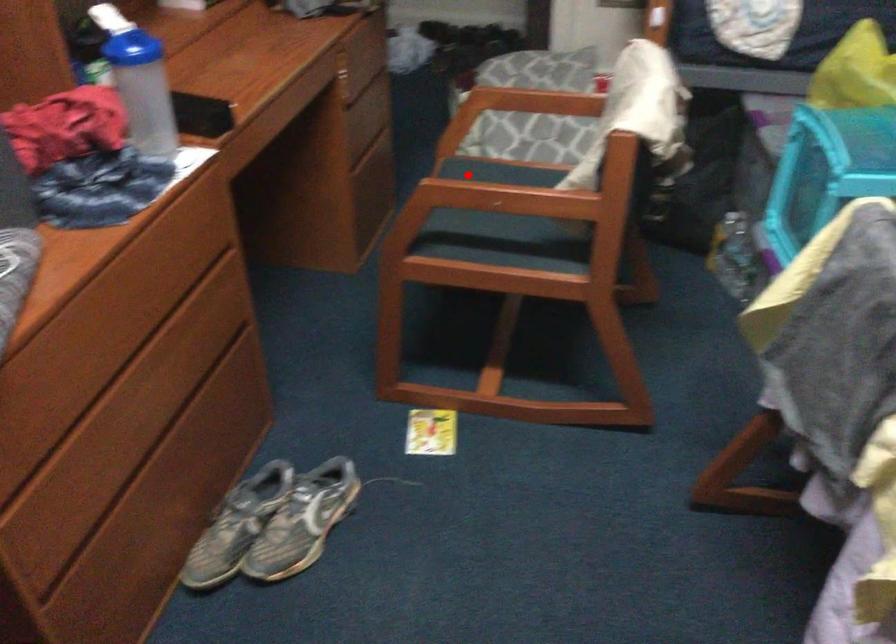
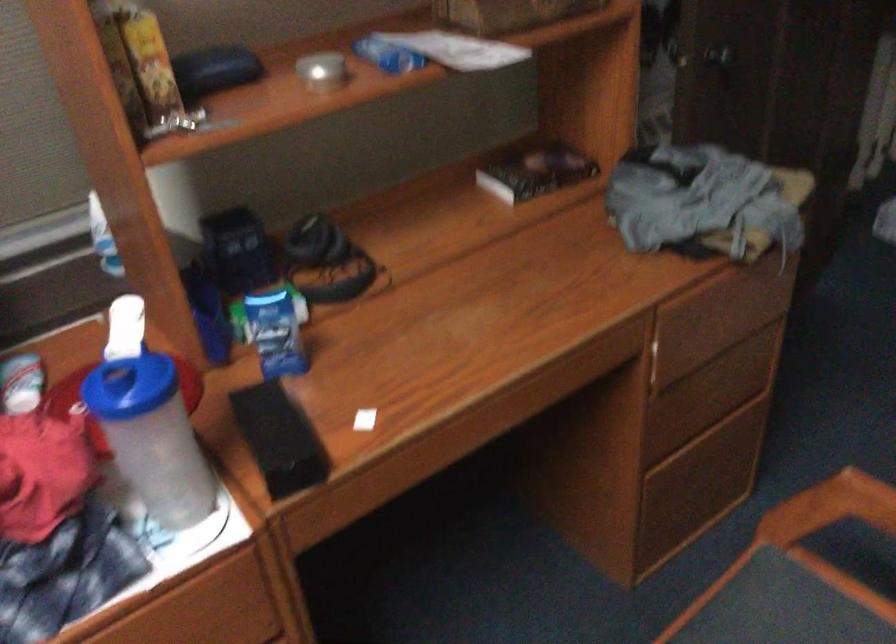
Question: I am providing you with two images of the same scene from different viewpoints. A red point is marked on the first image. Can you still see the location of the red point in image 2?

Choices:
 (A) Yes
 (B) No

Answer: (A)